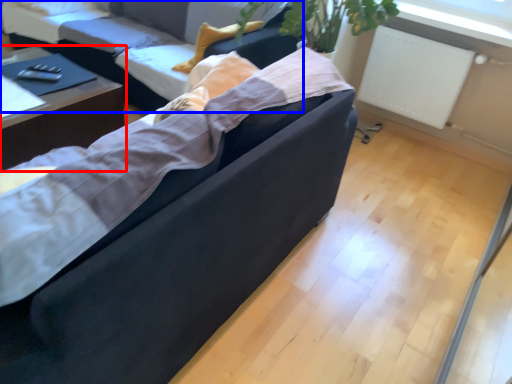
Question: Which point is closer to the camera, table (highlighted by a red box) or studio couch (highlighted by a blue box)?

Choices:
 (A) table
 (B) studio couch

Answer: (A)